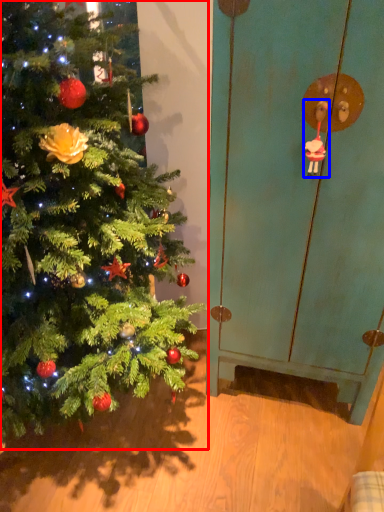
Question: Which object is closer to the camera taking this photo, christmas tree (highlighted by a red box) or toy (highlighted by a blue box)?

Choices:
 (A) christmas tree
 (B) toy

Answer: (A)